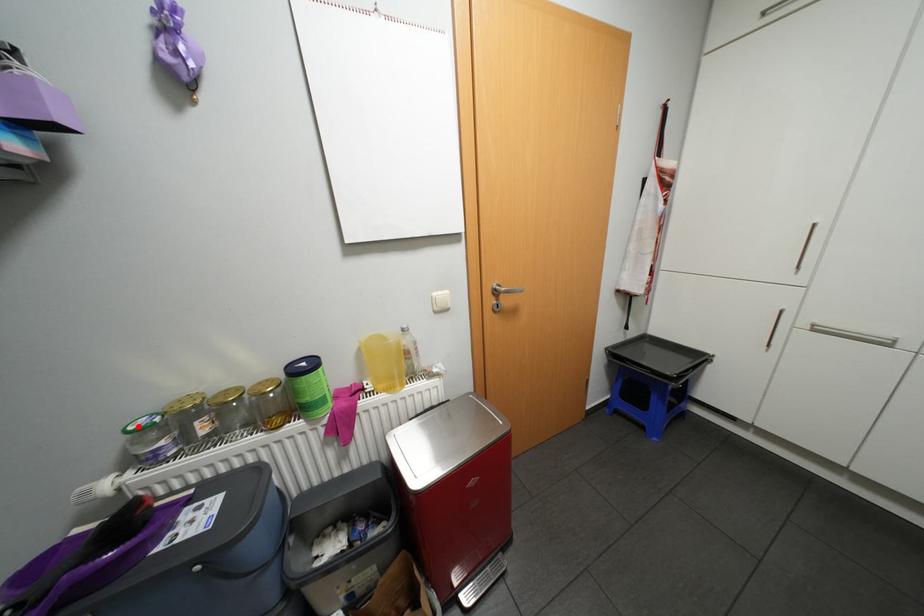
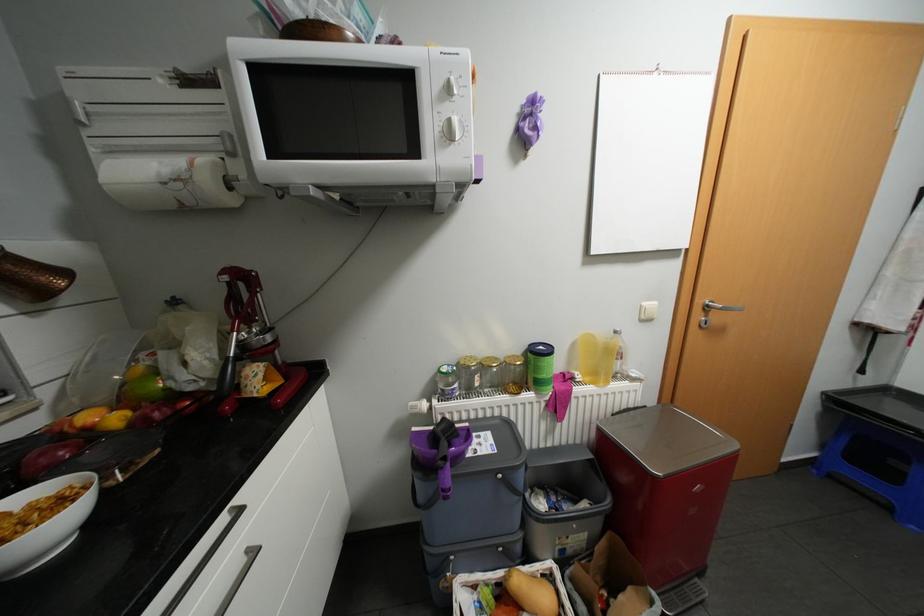
Locate, in the second image, the point that corresponds to the highlighted location in the first image.

(452, 369)